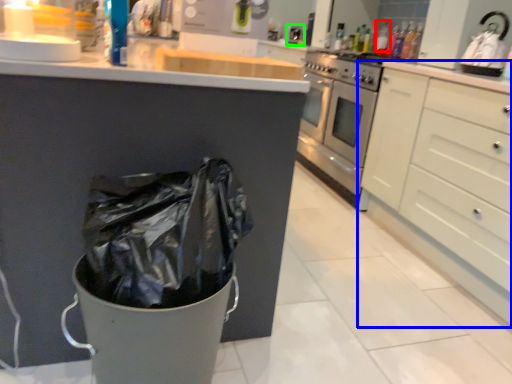
Question: Which object is positioned closest to bottle (highlighted by a red box)? Select from cabinetry (highlighted by a blue box) and sink (highlighted by a green box).

Choices:
 (A) cabinetry
 (B) sink

Answer: (B)